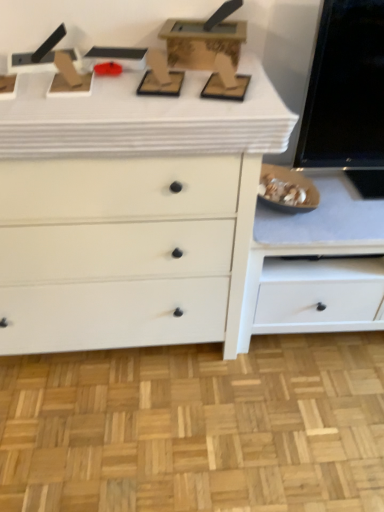
Question: Can you confirm if white matte cabinet at lower right is smaller than white matte chest of drawers at center?

Choices:
 (A) yes
 (B) no

Answer: (A)

Question: Is white matte cabinet at lower right further to camera compared to white matte chest of drawers at center?

Choices:
 (A) yes
 (B) no

Answer: (A)

Question: From the image's perspective, does white matte cabinet at lower right appear lower than white matte chest of drawers at center?

Choices:
 (A) yes
 (B) no

Answer: (A)

Question: From a real-world perspective, does white matte cabinet at lower right stand above white matte chest of drawers at center?

Choices:
 (A) yes
 (B) no

Answer: (B)

Question: Can you confirm if white matte cabinet at lower right is wider than white matte chest of drawers at center?

Choices:
 (A) yes
 (B) no

Answer: (B)

Question: Is white matte cabinet at lower right to the right of white matte chest of drawers at center from the viewer's perspective?

Choices:
 (A) no
 (B) yes

Answer: (B)

Question: Does white matte chest of drawers at center appear on the left side of white matte cabinet at lower right?

Choices:
 (A) yes
 (B) no

Answer: (A)

Question: Can you confirm if white matte chest of drawers at center is shorter than white matte cabinet at lower right?

Choices:
 (A) yes
 (B) no

Answer: (B)

Question: Is white matte chest of drawers at center oriented towards white matte cabinet at lower right?

Choices:
 (A) yes
 (B) no

Answer: (B)

Question: Is white matte chest of drawers at center closer to camera compared to white matte cabinet at lower right?

Choices:
 (A) yes
 (B) no

Answer: (A)

Question: Is white matte chest of drawers at center positioned behind white matte cabinet at lower right?

Choices:
 (A) no
 (B) yes

Answer: (A)

Question: Is white matte chest of drawers at center far away from white matte cabinet at lower right?

Choices:
 (A) no
 (B) yes

Answer: (A)

Question: Does white matte counter top at upper center have a larger size compared to white matte cabinet at lower right?

Choices:
 (A) yes
 (B) no

Answer: (B)